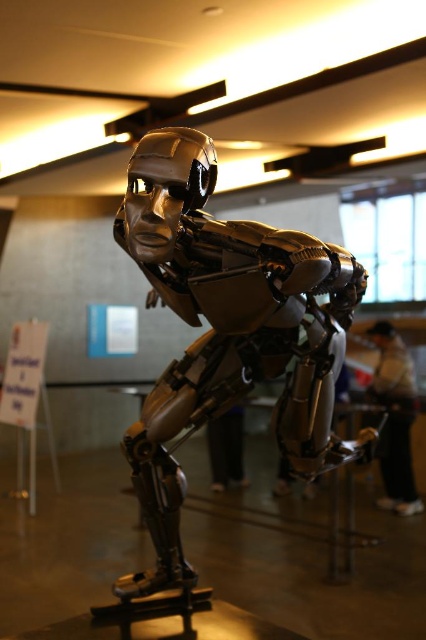
Question: Does metallic gold robot at center lie behind black matte pants at lower center?

Choices:
 (A) no
 (B) yes

Answer: (A)

Question: Where is dark gray fabric jacket at lower right located in relation to black matte pants at lower center in the image?

Choices:
 (A) right
 (B) left

Answer: (A)

Question: Which of these objects is positioned closest to the black matte pants at lower center?

Choices:
 (A) dark gray fabric jacket at lower right
 (B) metallic gold robot at center

Answer: (A)

Question: Which object appears farthest from the camera in this image?

Choices:
 (A) black matte pants at lower center
 (B) metallic gold robot at center
 (C) dark gray fabric jacket at lower right

Answer: (A)

Question: Can you confirm if metallic gold robot at center is smaller than dark gray fabric jacket at lower right?

Choices:
 (A) no
 (B) yes

Answer: (A)

Question: Among these points, which one is farthest from the camera?

Choices:
 (A) (238, 440)
 (B) (276, 292)
 (C) (400, 401)

Answer: (A)